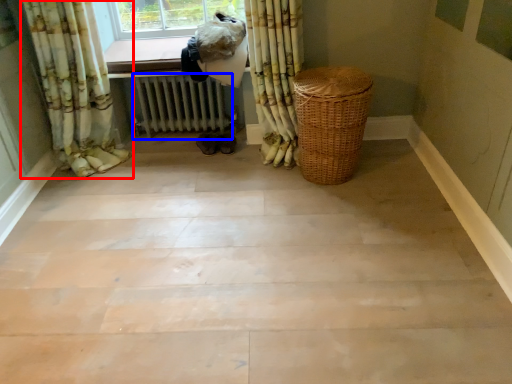
Question: Which point is closer to the camera, curtain (highlighted by a red box) or radiator (highlighted by a blue box)?

Choices:
 (A) curtain
 (B) radiator

Answer: (A)